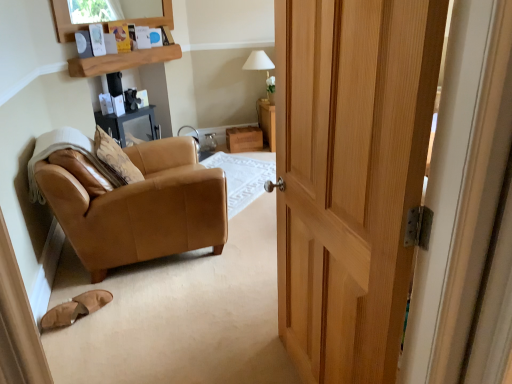
Identify the location of free space in front of tan suede slippers at lower left. (78, 339).